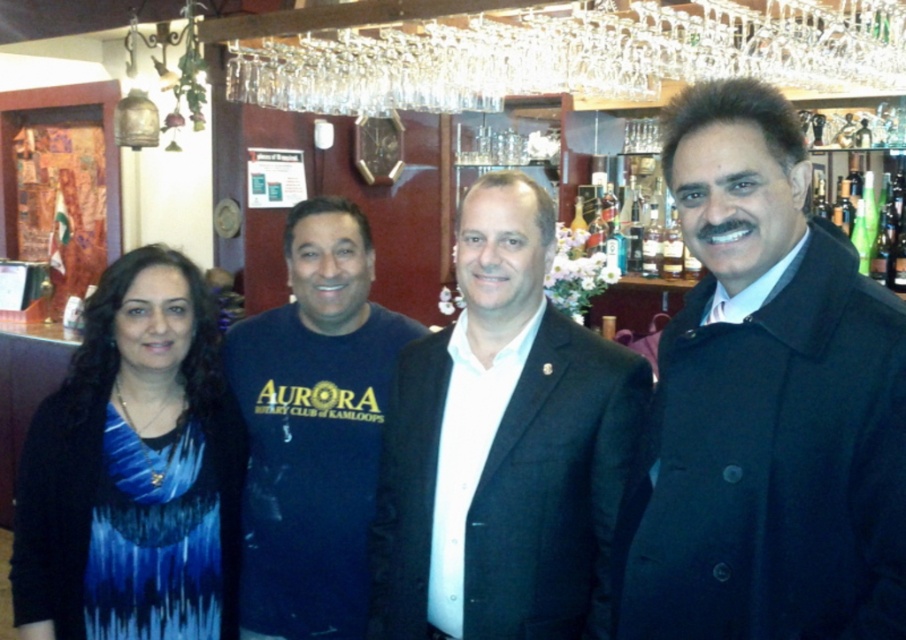
Consider the image. Does black wool coat at center have a greater width compared to black matte suit at center?

No.

Does black wool coat at center have a larger size compared to black matte suit at center?

No.

Does point (818, 275) come behind point (480, 390)?

No, it is not.

Identify the location of black wool coat at center. The width and height of the screenshot is (906, 640). [766, 404].

Does black matte suit at center have a greater width compared to blue printed dress at left?

Yes.

Is black matte suit at center further to the viewer compared to blue printed dress at left?

That is False.

You are a GUI agent. You are given a task and a screenshot of the screen. Output one action in this format:
    pyautogui.click(x=<x>, y=<y>)
    Task: Click on the black matte suit at center
    Image resolution: width=906 pixels, height=640 pixels.
    Given the screenshot: What is the action you would take?
    (503, 448)

Between point (205, 310) and point (348, 394), which one is positioned in front?

Point (205, 310) is in front.

Is blue printed dress at left wider than dark blue t-shirt at center?

Yes.

Does point (143, 364) come behind point (246, 476)?

No, it is in front of (246, 476).

Locate an element on the screen. blue printed dress at left is located at coordinates (133, 470).